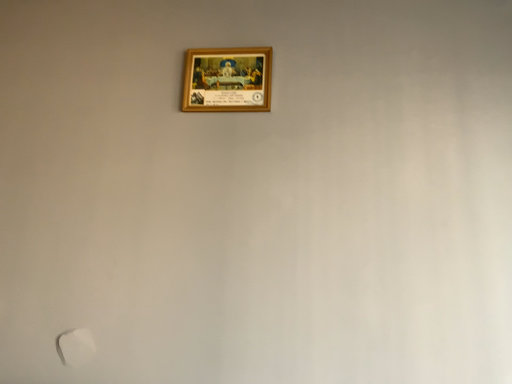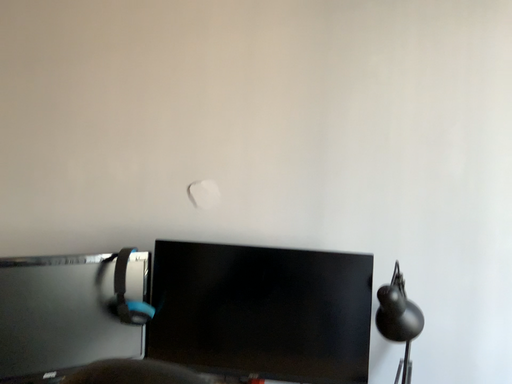
Question: Which way did the camera rotate in the video?

Choices:
 (A) rotated upward
 (B) rotated downward

Answer: (B)